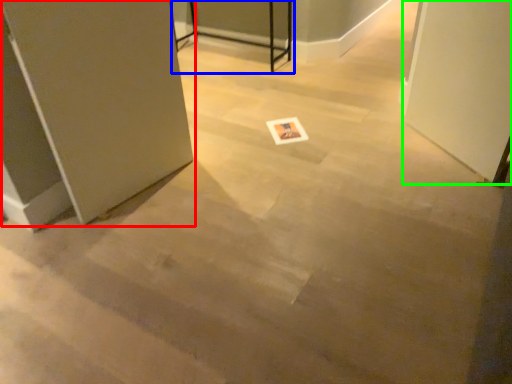
Question: Which object is the closest to the door (highlighted by a red box)? Choose among these: table (highlighted by a blue box) or screen door (highlighted by a green box).

Choices:
 (A) table
 (B) screen door

Answer: (B)